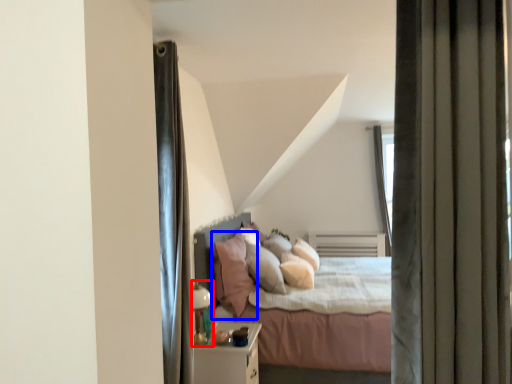
Question: Which object appears farthest to the camera in this image, lamp (highlighted by a red box) or pillow (highlighted by a blue box)?

Choices:
 (A) lamp
 (B) pillow

Answer: (B)